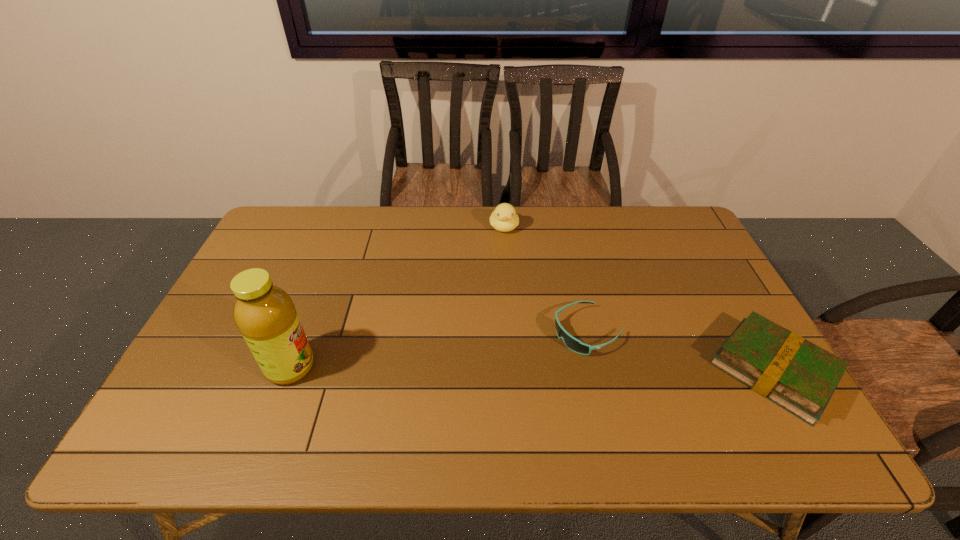
This screenshot has height=540, width=960. In order to click on free spot between the duckling and the sunglasses in this screenshot , I will do `click(546, 279)`.

The width and height of the screenshot is (960, 540). In order to click on empty space between the sunglasses and the book in this screenshot , I will do `click(681, 351)`.

You are a GUI agent. You are given a task and a screenshot of the screen. Output one action in this format:
    pyautogui.click(x=<x>, y=<y>)
    Task: Click on the vacant space that is in between the rightmost object and the leftmost object
    The height and width of the screenshot is (540, 960).
    Given the screenshot: What is the action you would take?
    pyautogui.click(x=532, y=369)

Identify the location of free space that is in between the leftmost object and the third shortest object. This screenshot has height=540, width=960. (397, 297).

Find the location of a particular element. empty space between the duckling and the shortest object is located at coordinates (546, 279).

Identify the location of vacant space that is in between the rightmost object and the third object from right to left. (638, 299).

Where is `free space between the third tallest object and the shortest object`? The width and height of the screenshot is (960, 540). free space between the third tallest object and the shortest object is located at coordinates (681, 351).

Select which object is the second closest to the third object from left to right. Please provide its 2D coordinates. Your answer should be formatted as a tuple, i.e. [(x, y)], where the tuple contains the x and y coordinates of a point satisfying the conditions above.

[(504, 218)]

At what (x,y) coordinates should I click in order to perform the action: click on the closest object relative to the fruit juice. Please return your answer as a coordinate pair (x, y). The image size is (960, 540). Looking at the image, I should click on (572, 343).